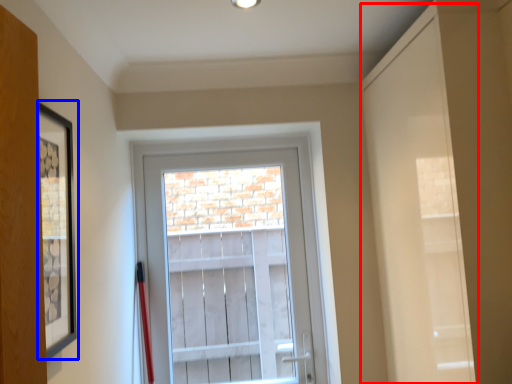
Question: Which of the following is the farthest to the observer, door (highlighted by a red box) or picture frame (highlighted by a blue box)?

Choices:
 (A) door
 (B) picture frame

Answer: (A)